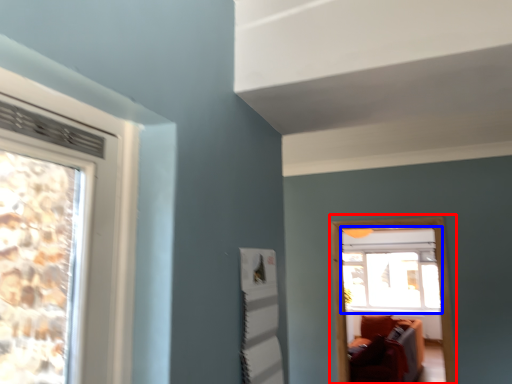
Question: Which object appears farthest to the camera in this image, window frame (highlighted by a red box) or window (highlighted by a blue box)?

Choices:
 (A) window frame
 (B) window

Answer: (B)